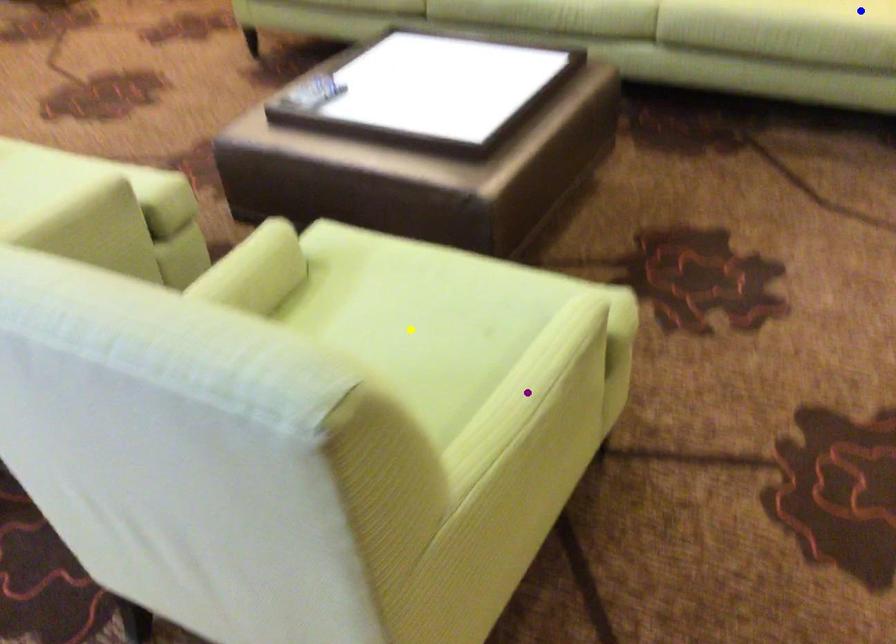
Order these from nearest to farthest:
1. blue point
2. yellow point
3. purple point

purple point
yellow point
blue point